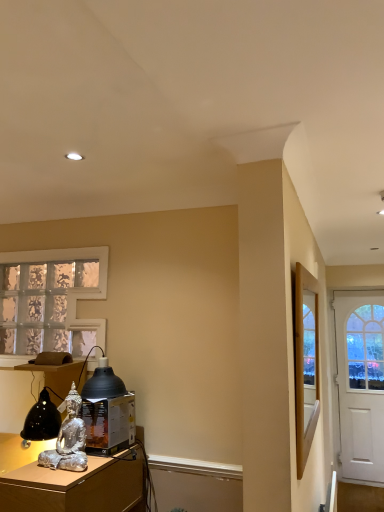
This screenshot has height=512, width=384. Identify the location of free point in front of silver metallic statue at lower left. (46, 485).